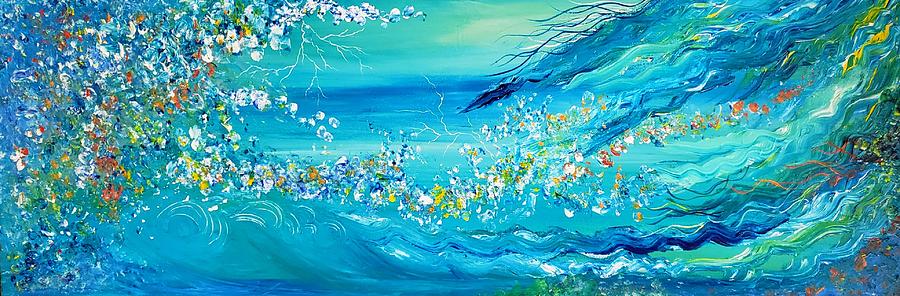
Locate an element on the screen. Image resolution: width=900 pixels, height=296 pixels. abstract painting is located at coordinates (68, 168), (244, 217), (378, 114), (564, 83), (724, 200).